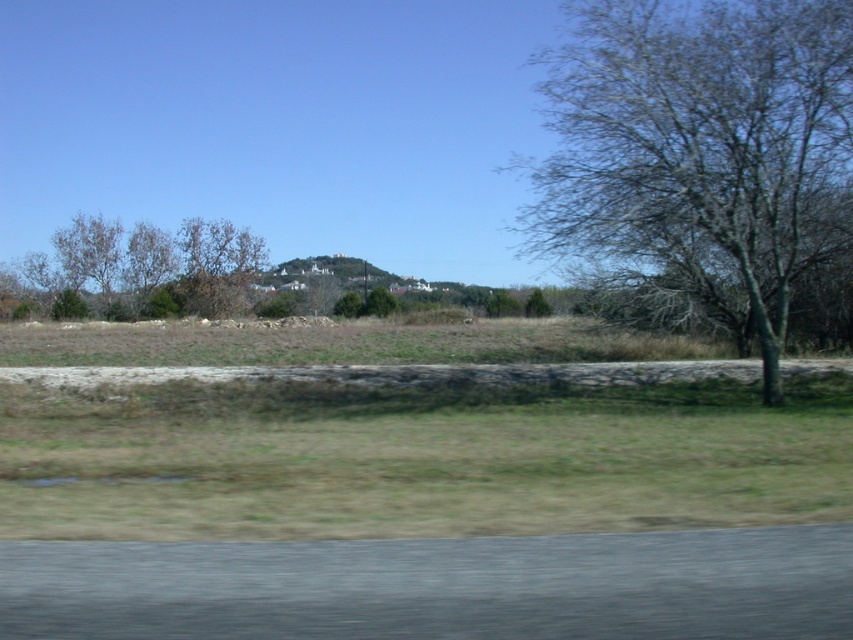
Which of these two, brown grass at center or brown leafless tree at center, stands shorter?

brown grass at center

Between brown grass at center and brown leafless tree at center, which one is positioned higher?

brown leafless tree at center is above.

Where is `brown grass at center`? The image size is (853, 640). brown grass at center is located at coordinates (416, 460).

Is point (173, 486) in front of point (836, 10)?

Yes, it is in front of point (836, 10).

Is point (505, 476) closer to viewer compared to point (521, 218)?

Yes, point (505, 476) is in front of point (521, 218).

Locate an element on the screen. The image size is (853, 640). brown grass at center is located at coordinates (416, 460).

Which is more to the left, green leafy tree at upper left or brown leafless tree at center?

green leafy tree at upper left

Between point (105, 268) and point (215, 225), which one is positioned behind?

Positioned behind is point (215, 225).

Which is behind, point (96, 227) or point (221, 243)?

Positioned behind is point (221, 243).

Locate an element on the screen. This screenshot has height=640, width=853. green leafy tree at upper left is located at coordinates (142, 269).